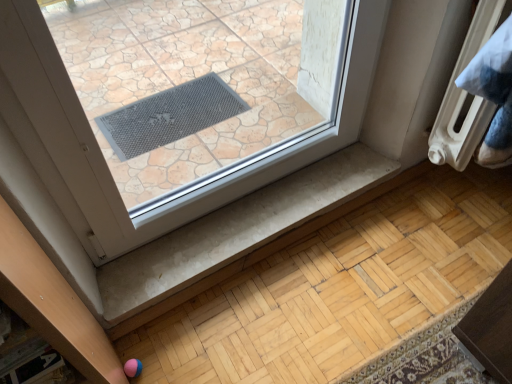
Question: Can you confirm if white matte stair at lower center is wider than white plastic radiator at upper right?

Choices:
 (A) no
 (B) yes

Answer: (B)

Question: Can you confirm if white matte stair at lower center is taller than white plastic radiator at upper right?

Choices:
 (A) no
 (B) yes

Answer: (A)

Question: From the image's perspective, does white matte stair at lower center appear lower than white plastic radiator at upper right?

Choices:
 (A) no
 (B) yes

Answer: (B)

Question: Can you confirm if white matte stair at lower center is positioned to the left of white plastic radiator at upper right?

Choices:
 (A) yes
 (B) no

Answer: (A)

Question: Considering the relative sizes of white matte stair at lower center and white plastic radiator at upper right in the image provided, is white matte stair at lower center smaller than white plastic radiator at upper right?

Choices:
 (A) yes
 (B) no

Answer: (A)

Question: Is white matte stair at lower center looking in the opposite direction of white plastic radiator at upper right?

Choices:
 (A) no
 (B) yes

Answer: (A)

Question: Does white plastic radiator at upper right have a greater width compared to white matte stair at lower center?

Choices:
 (A) yes
 (B) no

Answer: (B)

Question: Can you confirm if white plastic radiator at upper right is bigger than white matte stair at lower center?

Choices:
 (A) yes
 (B) no

Answer: (A)

Question: Can you confirm if white plastic radiator at upper right is thinner than white matte stair at lower center?

Choices:
 (A) yes
 (B) no

Answer: (A)

Question: Is white plastic radiator at upper right far away from white matte stair at lower center?

Choices:
 (A) no
 (B) yes

Answer: (A)

Question: Considering the relative positions of white plastic radiator at upper right and white matte stair at lower center in the image provided, is white plastic radiator at upper right to the left of white matte stair at lower center from the viewer's perspective?

Choices:
 (A) yes
 (B) no

Answer: (B)

Question: Is white plastic radiator at upper right facing towards white matte stair at lower center?

Choices:
 (A) yes
 (B) no

Answer: (B)

Question: From a real-world perspective, is white matte stair at lower center physically located above or below white plastic radiator at upper right?

Choices:
 (A) below
 (B) above

Answer: (A)